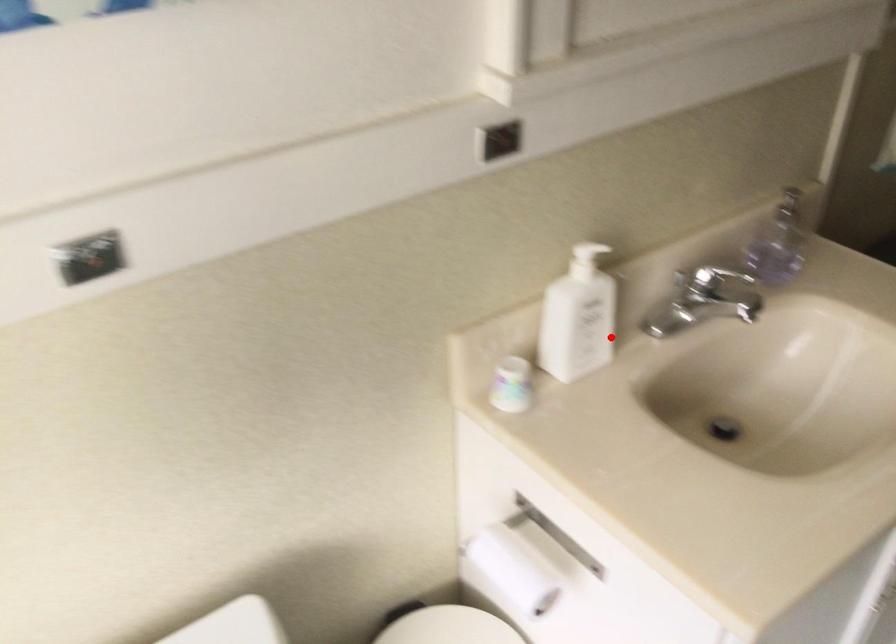
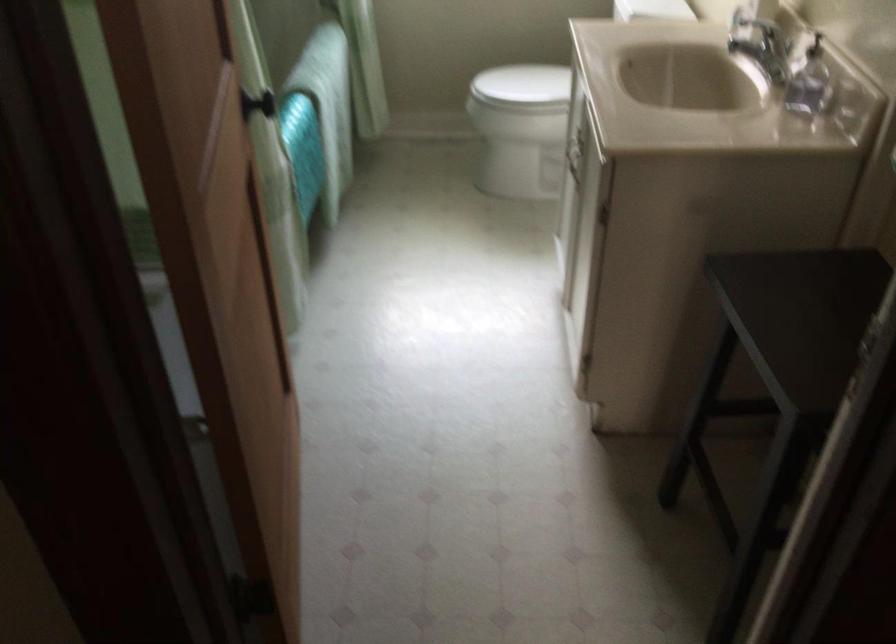
Question: I am providing you with two images of the same scene from different viewpoints. In image1, a red point is highlighted. Considering the same 3D point in image2, which of the following is correct?

Choices:
 (A) It is closer
 (B) It is farther

Answer: (B)